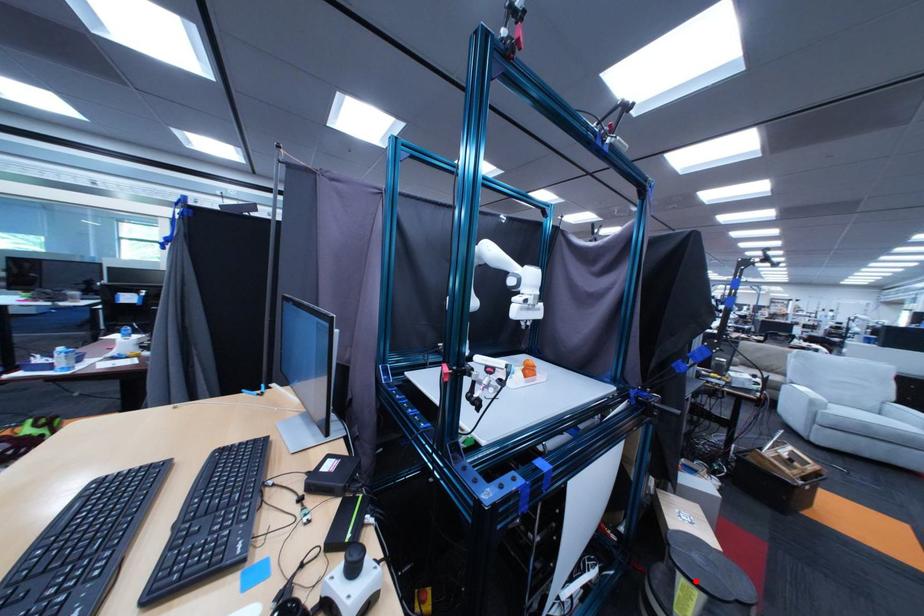
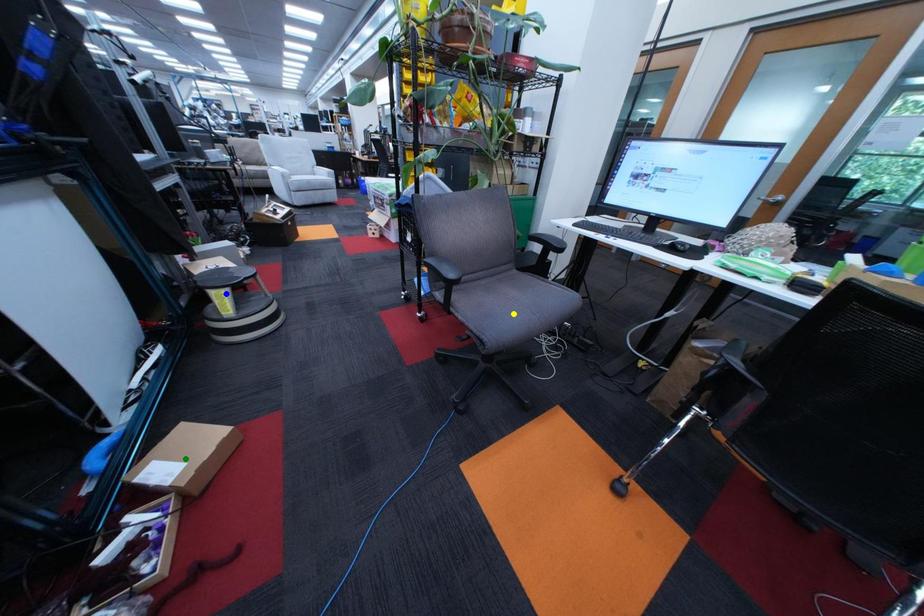
Question: I am providing you with two images of the same scene from different viewpoints. A red point is marked on the first image. You are given multiple points on the second image. Which point in image 2 represents the same 3d spot as the red point in image 1?

Choices:
 (A) blue point
 (B) yellow point
 (C) green point

Answer: (A)